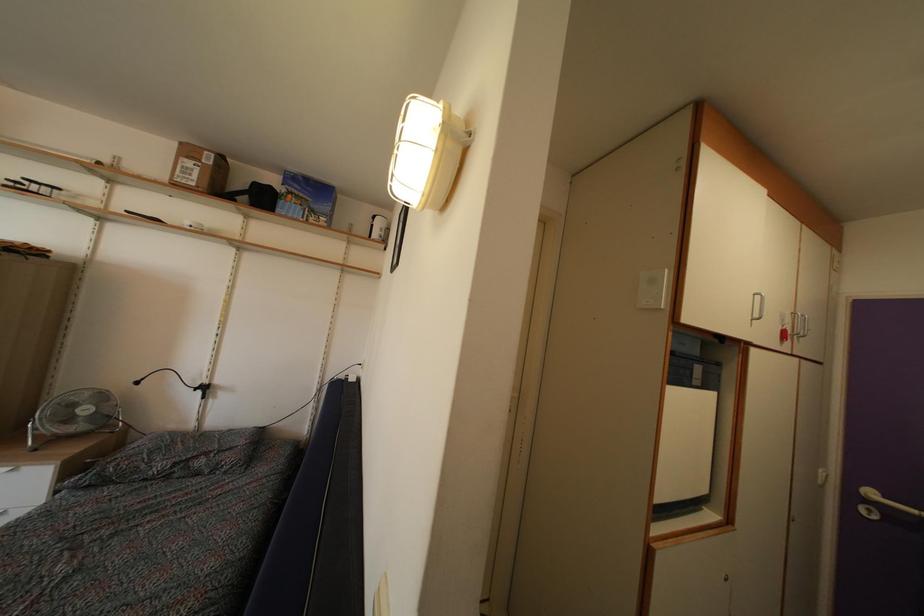
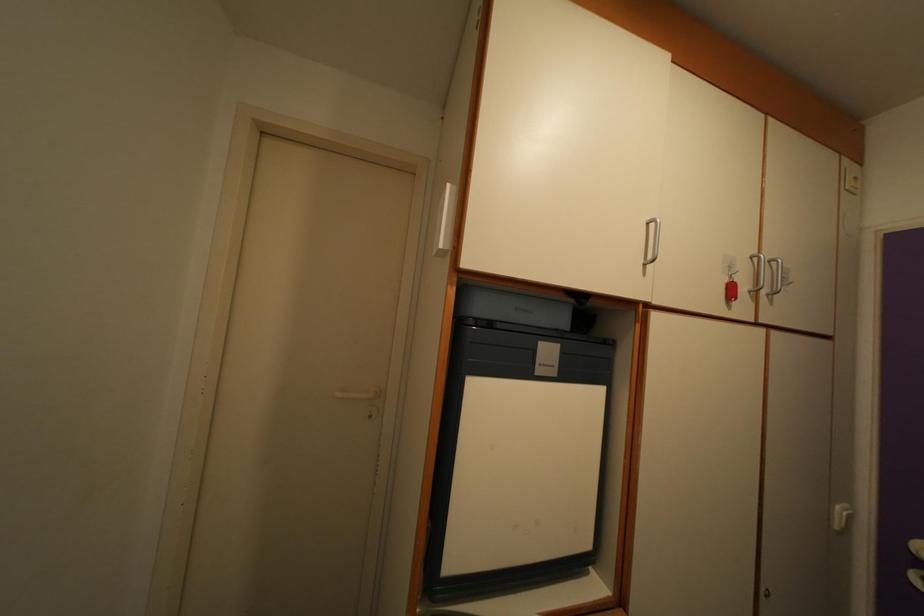
In the second image, find the point that corresponds to pixel 709 500 in the first image.

(591, 554)